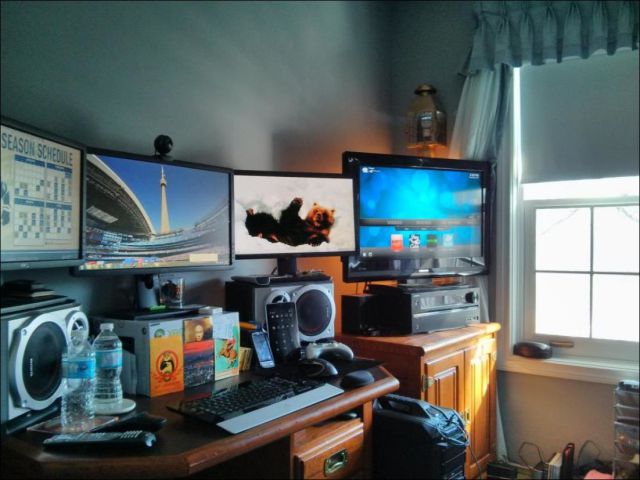
You are a GUI agent. You are given a task and a screenshot of the screen. Output one action in this format:
    pyautogui.click(x=<x>, y=<y>)
    Task: Click on the knob
    The height and width of the screenshot is (480, 640).
    Given the screenshot: What is the action you would take?
    pyautogui.click(x=474, y=297)